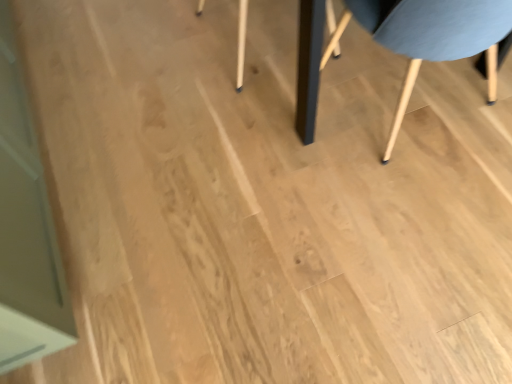
What do you see at coordinates (401, 43) in the screenshot? I see `blue fabric chair at center` at bounding box center [401, 43].

The width and height of the screenshot is (512, 384). In order to click on blue fabric chair at center in this screenshot , I will do `click(401, 43)`.

The image size is (512, 384). Find the location of `blue fabric chair at center`. blue fabric chair at center is located at coordinates (x=401, y=43).